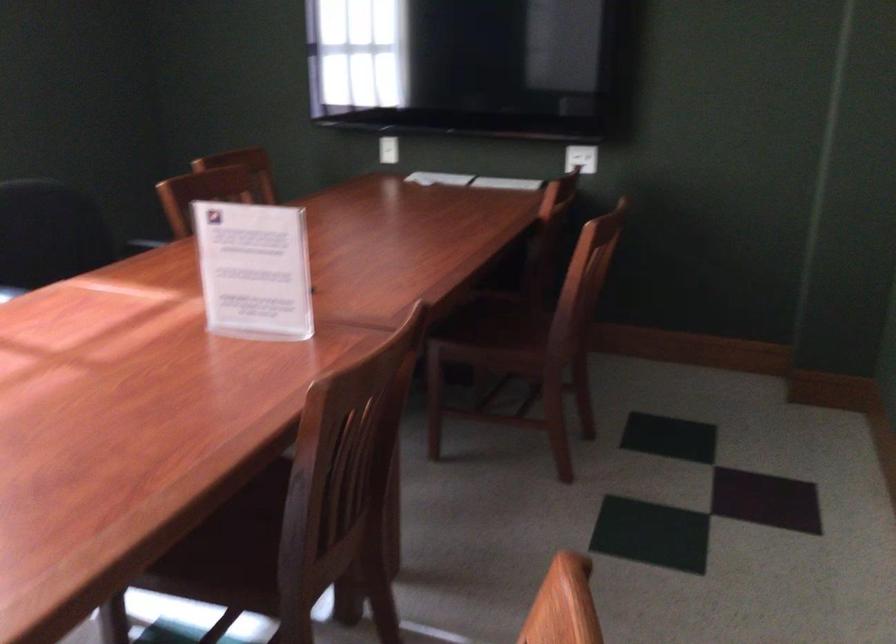
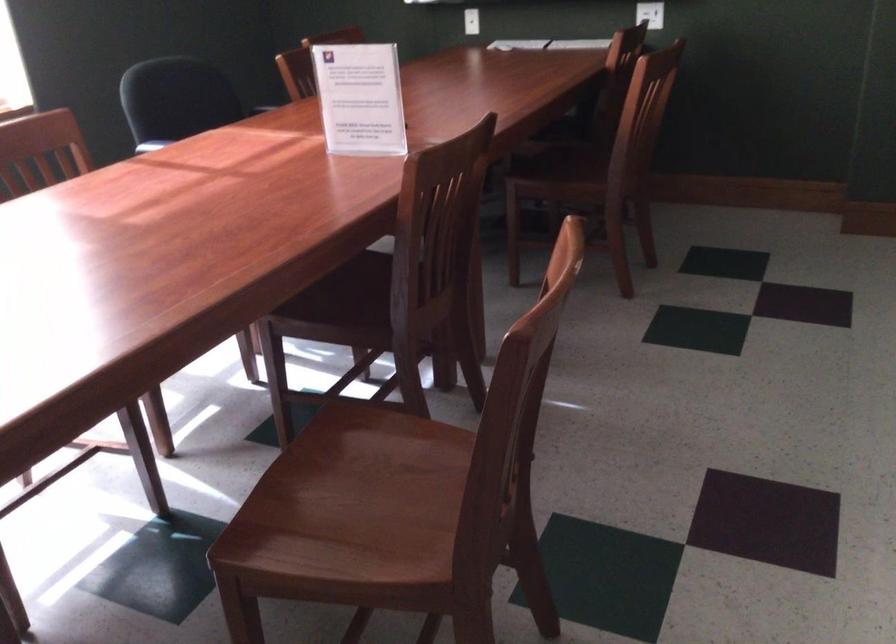
Question: The camera is either moving clockwise (left) or counter-clockwise (right) around the object. The first image is from the beginning of the video and the second image is from the end. Is the camera moving left or right when shooting the video?

Choices:
 (A) Left
 (B) Right

Answer: (B)